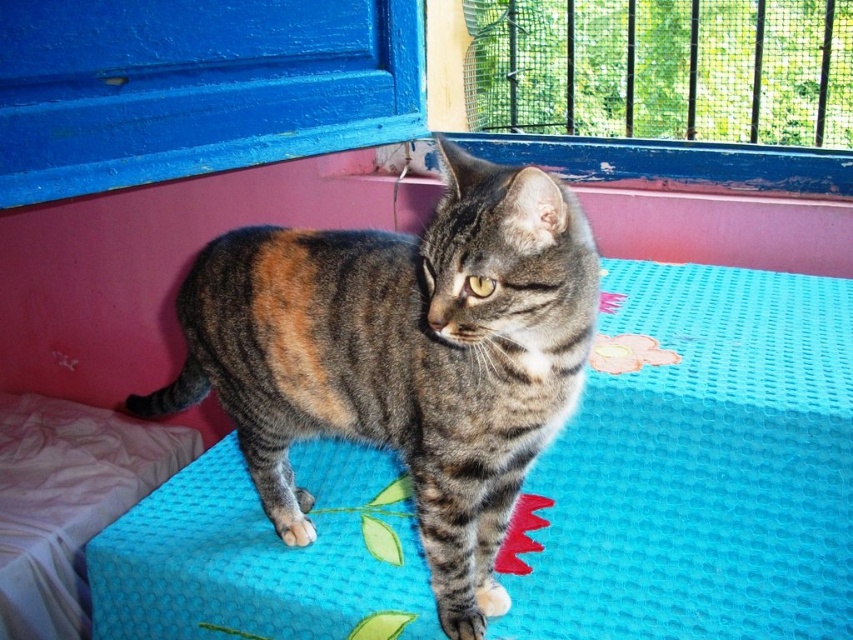
Who is more distant from viewer, (480, 513) or (25, 467)?

Point (25, 467)

Measure the distance between tabby fur cat at center and camera.

A distance of 25.44 inches exists between tabby fur cat at center and camera.

Find the location of a particular element. This screenshot has width=853, height=640. tabby fur cat at center is located at coordinates (402, 356).